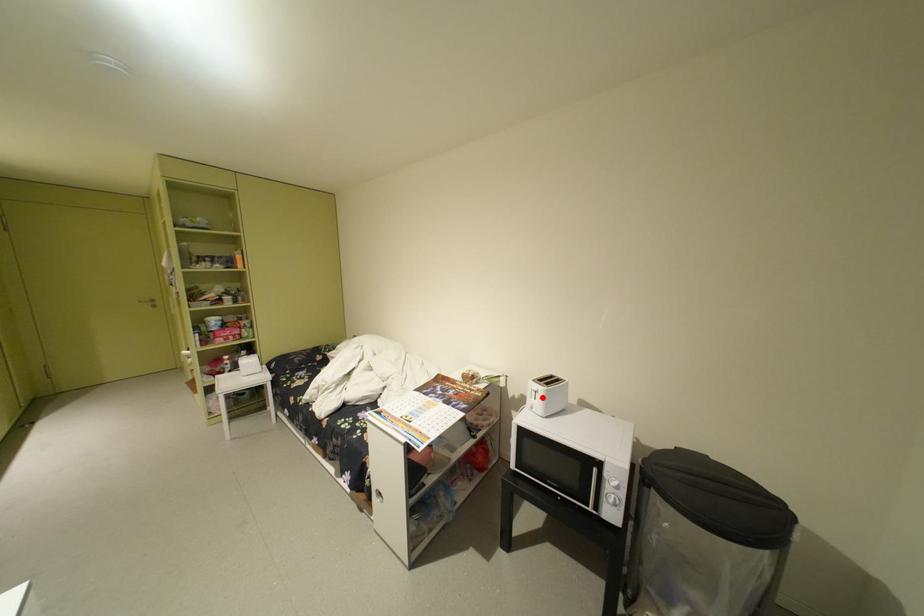
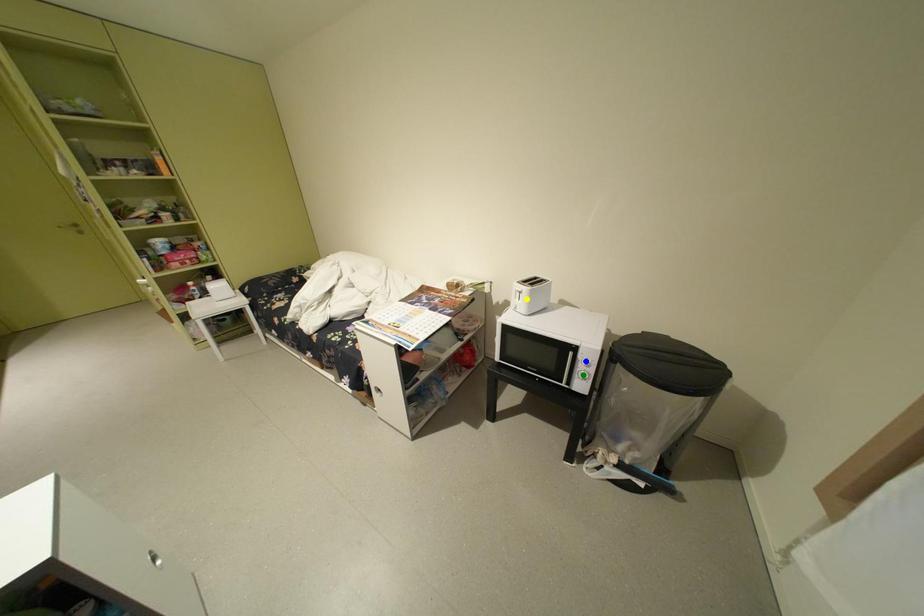
Question: I am providing you with two images of the same scene from different viewpoints. A red point is marked on the first image. You are given multiple points on the second image. Which point in image 2 is actually the same real-world point as the red point in image 1?

Choices:
 (A) yellow point
 (B) blue point
 (C) green point

Answer: (A)